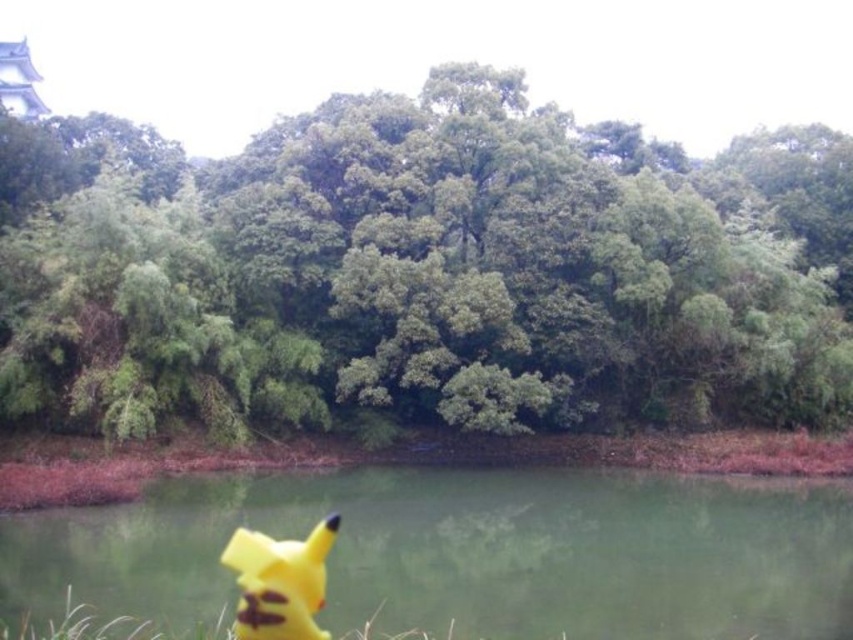
Question: Among these points, which one is farthest from the camera?

Choices:
 (A) (757, 499)
 (B) (479, 330)

Answer: (B)

Question: From the image, what is the correct spatial relationship of green leafy tree at center in relation to yellow matte pikachu at lower left?

Choices:
 (A) above
 (B) below

Answer: (A)

Question: Which object is closer to the camera taking this photo?

Choices:
 (A) yellow matte pikachu at lower left
 (B) green leafy tree at center

Answer: (A)

Question: Can you confirm if green leafy tree at center is thinner than yellow fabric pikachu at lower center?

Choices:
 (A) yes
 (B) no

Answer: (B)

Question: Which point is closer to the camera taking this photo?

Choices:
 (A) (289, 612)
 (B) (289, 412)

Answer: (A)

Question: Is green leafy tree at center below yellow matte pikachu at lower left?

Choices:
 (A) no
 (B) yes

Answer: (A)